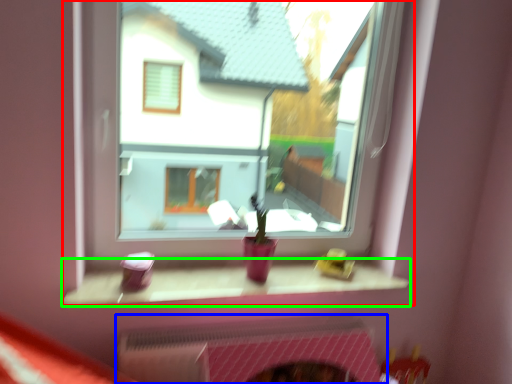
Question: Based on their relative distances, which object is farther from window (highlighted by a red box)? Choose from fireplace (highlighted by a blue box) and window sill (highlighted by a green box).

Choices:
 (A) fireplace
 (B) window sill

Answer: (A)